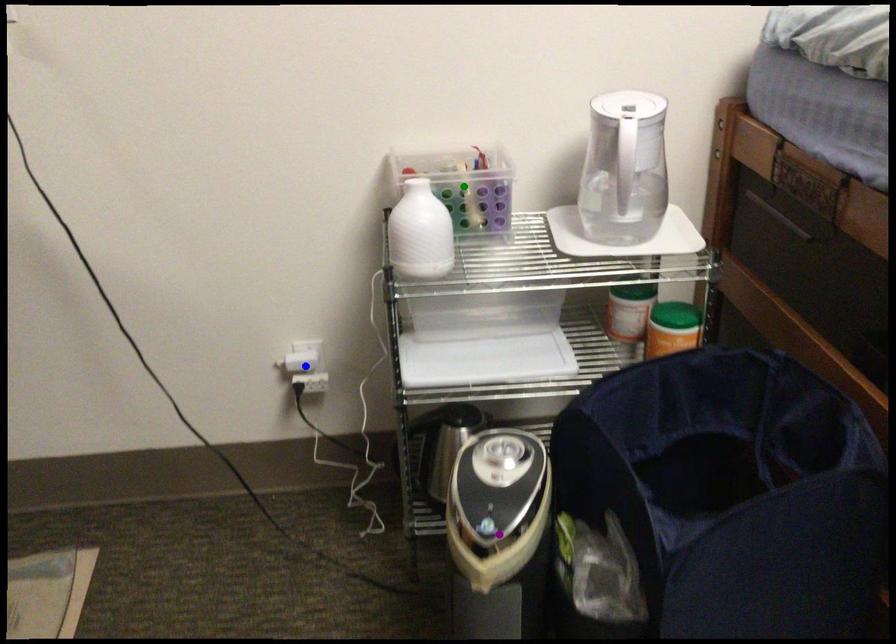
Order these from nearest to farthest:
- blue point
- purple point
- green point

purple point
green point
blue point